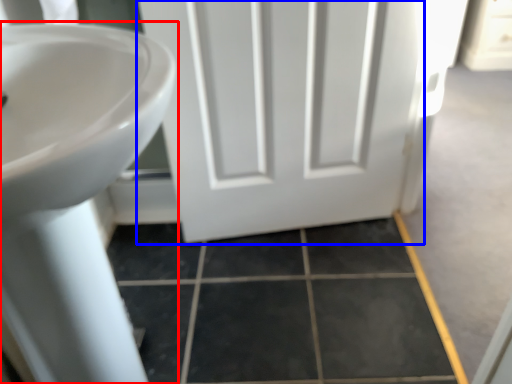
Question: Which point is closer to the camera, sink (highlighted by a red box) or door (highlighted by a blue box)?

Choices:
 (A) sink
 (B) door

Answer: (A)